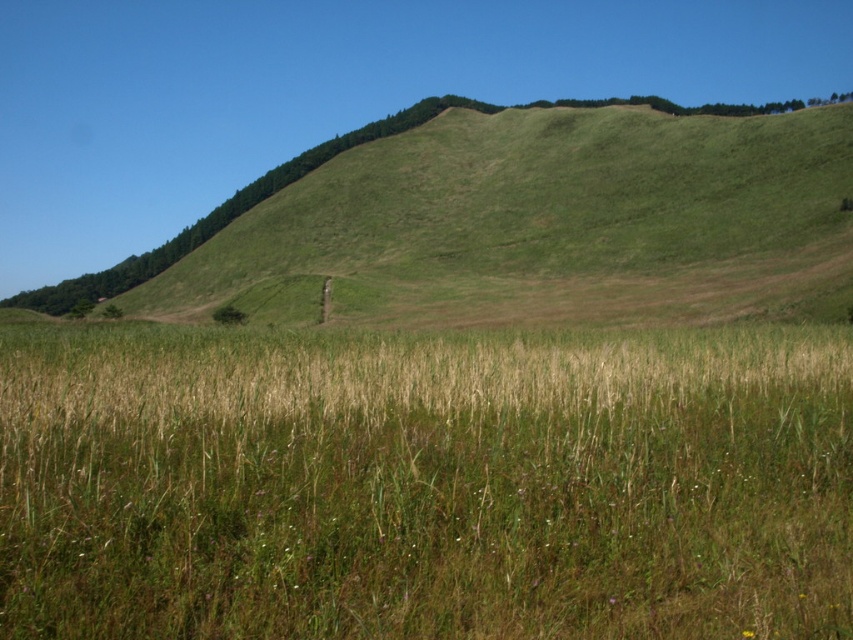
Question: Can you confirm if green grass at center is positioned to the left of green grassy hillside at upper center?

Choices:
 (A) no
 (B) yes

Answer: (B)

Question: Does green grass at center appear on the left side of green grassy hillside at upper center?

Choices:
 (A) yes
 (B) no

Answer: (A)

Question: Which point is closer to the camera?

Choices:
 (A) (753, 596)
 (B) (825, 256)

Answer: (A)

Question: Among these points, which one is nearest to the camera?

Choices:
 (A) (422, 502)
 (B) (618, 131)

Answer: (A)

Question: Does green grass at center appear on the left side of green grassy hillside at upper center?

Choices:
 (A) yes
 (B) no

Answer: (A)